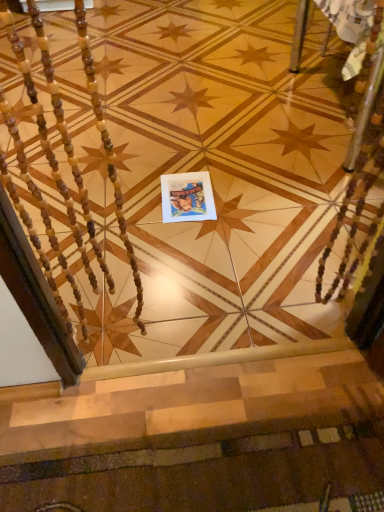
Locate an element on the screen. Image resolution: width=384 pixels, height=512 pixels. vacant point above carpeted stairs at lower center (from a real-world perspective) is located at coordinates [220, 471].